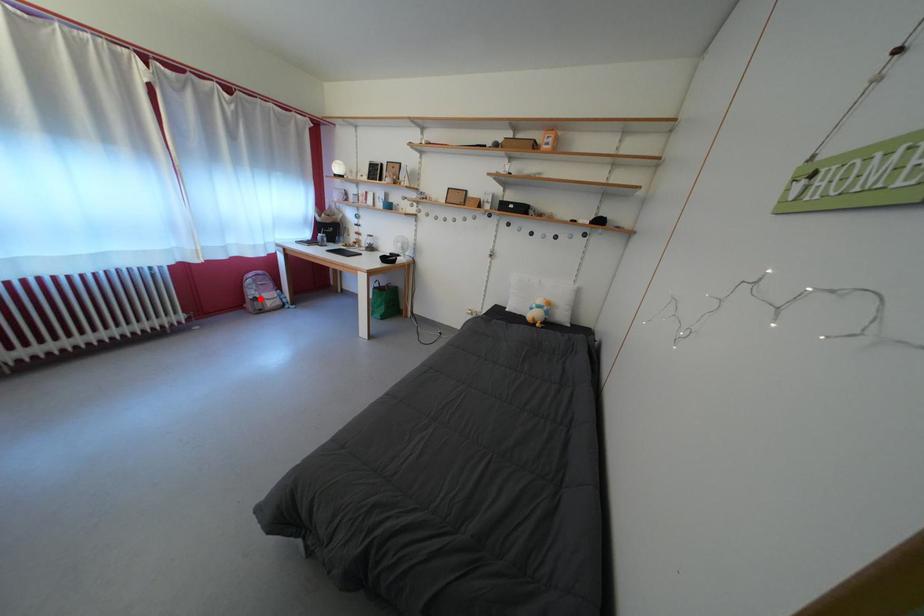
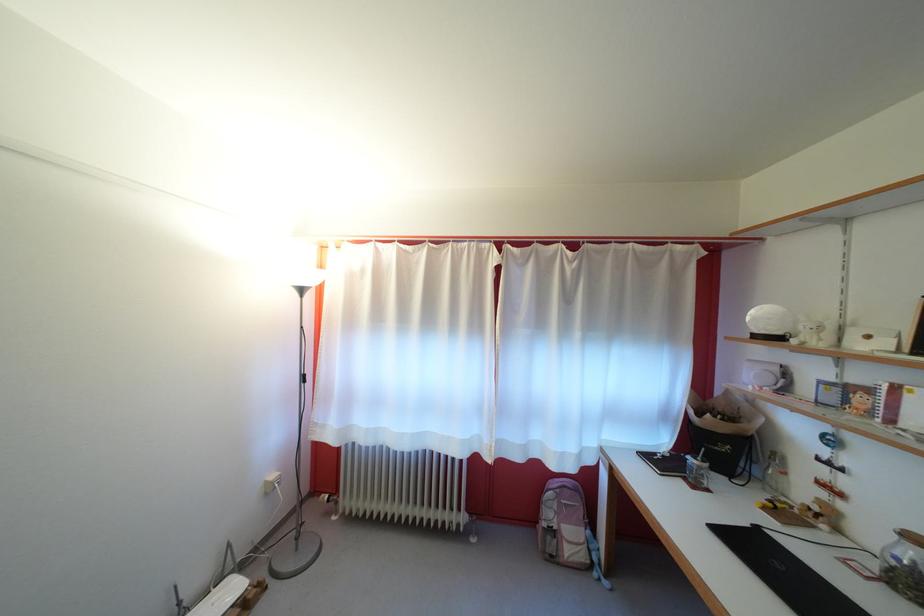
Where in the second image is the point corresponding to the highlighted location from the first image?

(556, 521)